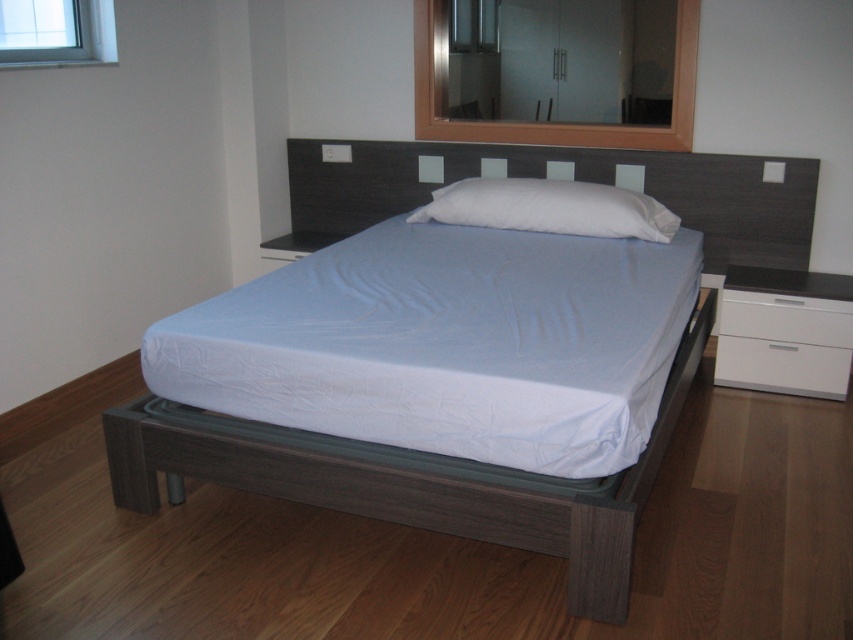
You are arranging a minimalist bedroom and have to place a white fabric mattress at center and a white soft pillow at center. Since space is limited, which object should you prioritize placing first to ensure both fit?

The white fabric mattress at center is bigger than the white soft pillow at center, so you should prioritize placing the white fabric mattress at center first to ensure there is enough space for both.

You are standing in the minimalist bedroom and want to place a small decorative item on one of the two points mentioned. Which point is closer to you, point (492, 515) or point (756, 384)?

Point (492, 515) is closer to the viewer than point (756, 384), so you should place the decorative item there if you want it nearer to your position.